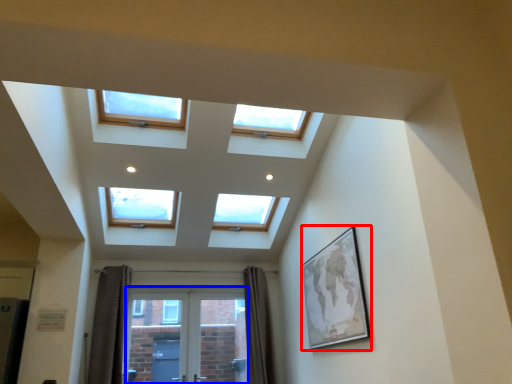
Question: Among these objects, which one is farthest to the camera, picture frame (highlighted by a red box) or screen door (highlighted by a blue box)?

Choices:
 (A) picture frame
 (B) screen door

Answer: (B)